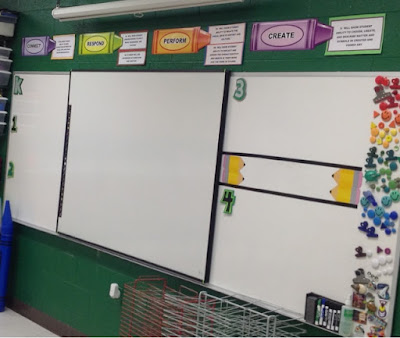
Find the location of a particular element. The height and width of the screenshot is (338, 400). plug in air refreshner is located at coordinates (113, 292).